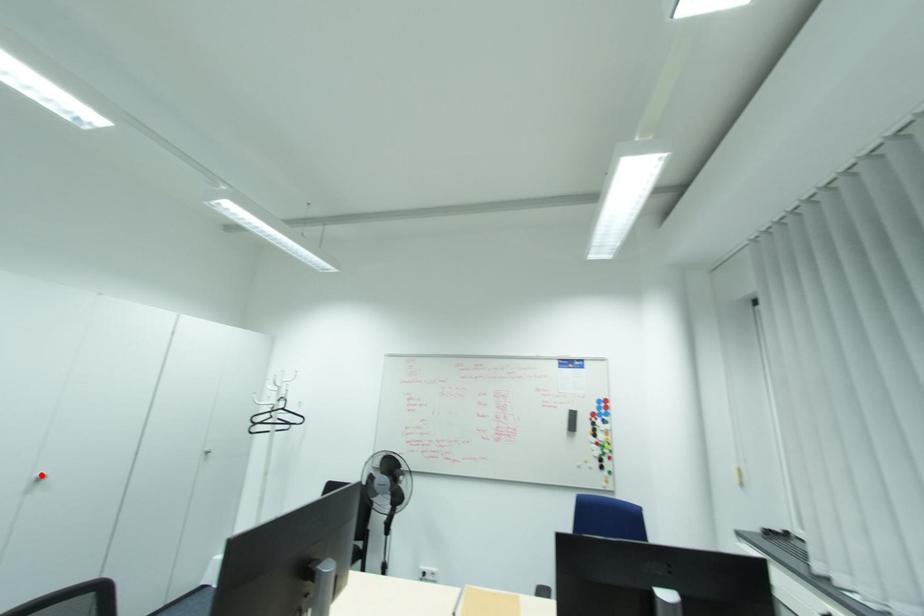
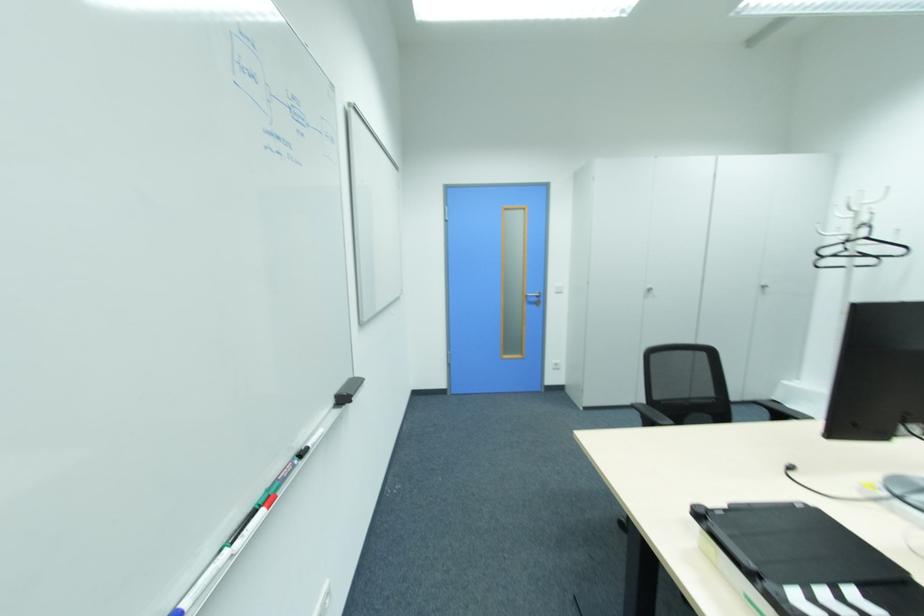
The point at the highlighted location is marked in the first image. Where is the corresponding point in the second image?

(650, 288)